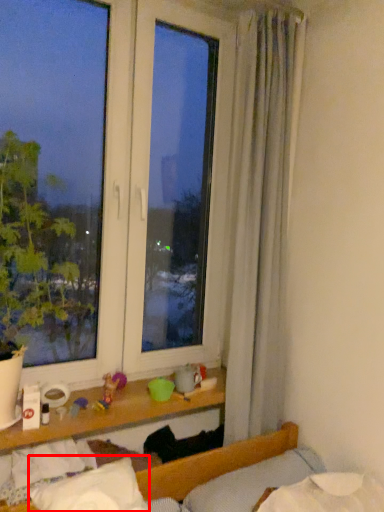
Question: Where is pillow (annotated by the red box) located in relation to pillow in the image?

Choices:
 (A) left
 (B) right

Answer: (A)